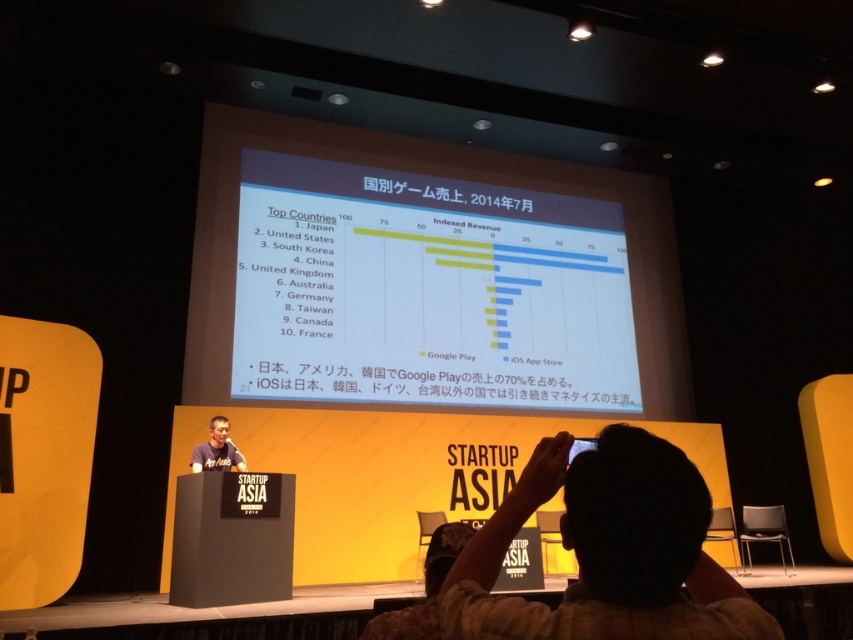
Looking at this image, is brown plaid shirt at lower right bigger than matte black shirt at center?

Actually, brown plaid shirt at lower right might be smaller than matte black shirt at center.

Locate an element on the screen. This screenshot has width=853, height=640. brown plaid shirt at lower right is located at coordinates (607, 552).

Find the location of a particular element. matte white chart at center is located at coordinates (427, 291).

What do you see at coordinates (427, 291) in the screenshot?
I see `matte white chart at center` at bounding box center [427, 291].

This screenshot has height=640, width=853. I want to click on matte white chart at center, so click(x=427, y=291).

Who is higher up, matte white chart at center or matte black shirt at center?

Positioned higher is matte white chart at center.

Between point (300, 236) and point (219, 444), which one is positioned behind?

Point (300, 236)

At what (x,y) coordinates should I click in order to perform the action: click on matte white chart at center. Please return your answer as a coordinate pair (x, y). This screenshot has height=640, width=853. Looking at the image, I should click on (427, 291).

Where is `matte white chart at center`? Image resolution: width=853 pixels, height=640 pixels. matte white chart at center is located at coordinates (427, 291).